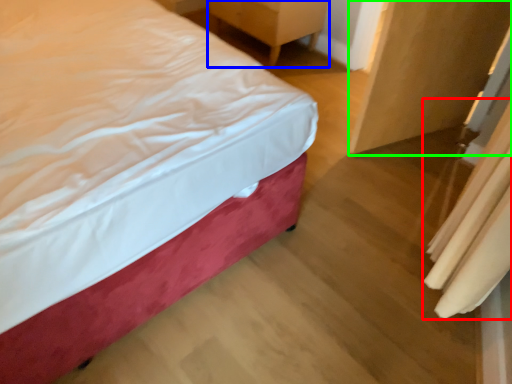
Question: Considering the real-world distances, which object is farthest from curtain (highlighted by a red box)? furniture (highlighted by a blue box) or armoire (highlighted by a green box)?

Choices:
 (A) furniture
 (B) armoire

Answer: (A)